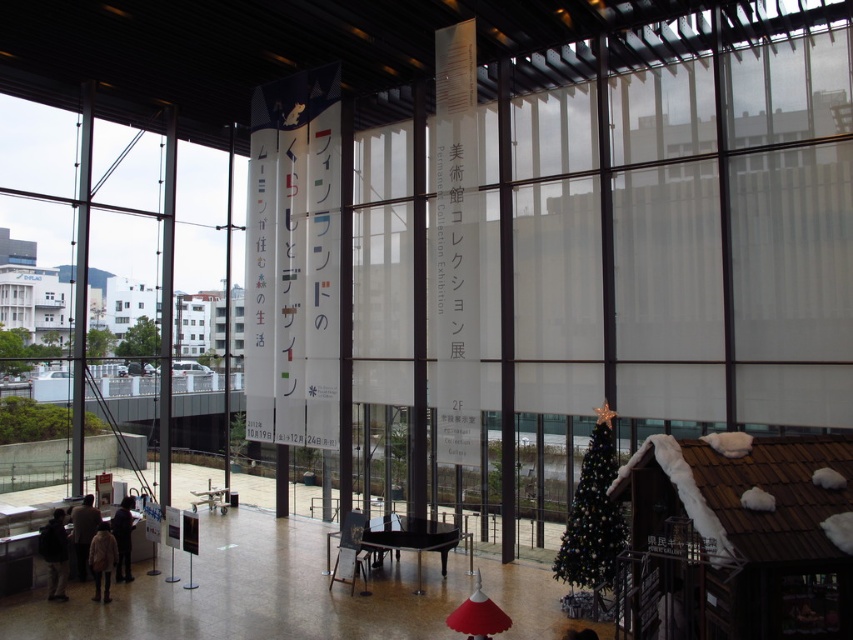
Question: From the image, what is the correct spatial relationship of green matte christmas tree at lower right in relation to dark gray sweater at lower left?

Choices:
 (A) left
 (B) right

Answer: (B)

Question: Does dark gray backpack at lower left have a larger size compared to dark gray sweater at lower left?

Choices:
 (A) yes
 (B) no

Answer: (B)

Question: Which of the following is the closest to the observer?

Choices:
 (A) (90, 497)
 (B) (585, 545)

Answer: (B)

Question: Which is nearer to the green matte christmas tree at lower right?

Choices:
 (A) dark gray sweater at lower left
 (B) light brown fur coat at lower left

Answer: (B)

Question: Does dark brown leather jacket at lower left have a greater width compared to dark gray sweater at lower left?

Choices:
 (A) yes
 (B) no

Answer: (A)

Question: Among these points, which one is nearest to the camera?

Choices:
 (A) (80, 538)
 (B) (67, 538)

Answer: (B)